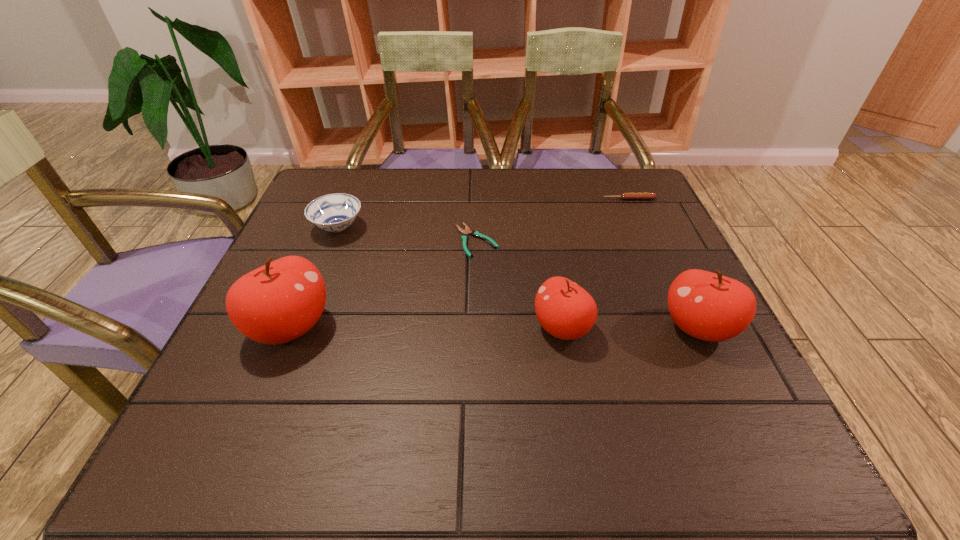
Locate an element on the screen. This screenshot has height=540, width=960. free spot located on the back of the leftmost apple is located at coordinates (316, 266).

Locate an element on the screen. The width and height of the screenshot is (960, 540). vacant space located 0.260m on the left of the third object from right to left is located at coordinates (402, 328).

Find the location of a particular element. The image size is (960, 540). vacant space situated 0.270m on the left of the second tallest object is located at coordinates (525, 328).

The image size is (960, 540). What are the coordinates of `vacant position located 0.100m on the right of the pliers` in the screenshot? It's located at (539, 241).

Locate an element on the screen. The width and height of the screenshot is (960, 540). vacant space located on the left of the second shortest object is located at coordinates (531, 199).

Locate an element on the screen. The width and height of the screenshot is (960, 540). free spot located 0.120m on the front of the soup bowl is located at coordinates (319, 278).

I want to click on sausage present at the far edge, so click(625, 196).

At what (x,y) coordinates should I click in order to perform the action: click on soup bowl that is at the far edge. Please return your answer as a coordinate pair (x, y). The width and height of the screenshot is (960, 540). Looking at the image, I should click on (335, 212).

Where is `apple that is positioned at the left edge`? apple that is positioned at the left edge is located at coordinates (276, 303).

This screenshot has height=540, width=960. Find the location of `soup bowl that is positioned at the left edge`. soup bowl that is positioned at the left edge is located at coordinates (335, 212).